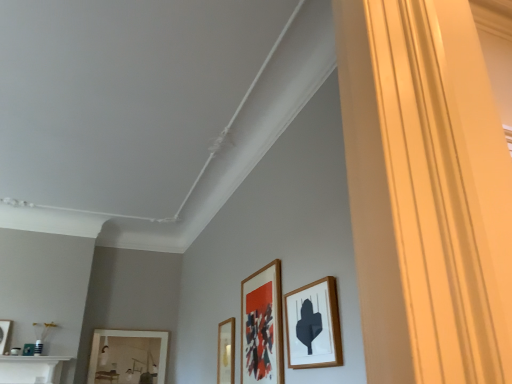
You are a GUI agent. You are given a task and a screenshot of the screen. Output one action in this format:
    pyautogui.click(x=<x>, y=<y>)
    Task: Click on the matte white picture frame at lower left, marked as the 2th picture frame in a back-to-front arrangement
    This screenshot has height=384, width=512.
    Given the screenshot: What is the action you would take?
    pyautogui.click(x=4, y=334)

What do you see at coordinates (226, 351) in the screenshot? This screenshot has height=384, width=512. I see `wooden picture frame at lower center, acting as the 3th picture frame starting from the front` at bounding box center [226, 351].

In order to face wooden picture frame at right, the 5th picture frame viewed from the left, should I rotate leftwards or rightwards?

Turn right by 7.136 degrees to look at wooden picture frame at right, the 5th picture frame viewed from the left.

Where is `matte wooden picture frame at center, marked as the second picture frame in a front-to-back arrangement`? This screenshot has width=512, height=384. matte wooden picture frame at center, marked as the second picture frame in a front-to-back arrangement is located at coordinates (262, 326).

From a real-world perspective, is wooden picture frame at lower left, which is the 5th picture frame from front to back, above or below matte white picture frame at lower left, the 5th picture frame from the right?

wooden picture frame at lower left, which is the 5th picture frame from front to back, is situated lower than matte white picture frame at lower left, the 5th picture frame from the right, in the real world.

Which is behind, point (151, 364) or point (8, 335)?

The point (151, 364) is farther from the camera.

From the image's perspective, is wooden picture frame at lower left, which is the 5th picture frame from front to back, located above or below matte white picture frame at lower left, which appears as the first picture frame when viewed from the left?

Clearly, from the image's perspective, wooden picture frame at lower left, which is the 5th picture frame from front to back, is below matte white picture frame at lower left, which appears as the first picture frame when viewed from the left.

Is wooden picture frame at lower left, which is the 5th picture frame from front to back, further to camera compared to matte white picture frame at lower left, which appears as the first picture frame when viewed from the left?

Yes, wooden picture frame at lower left, which is the 5th picture frame from front to back, is further from the viewer.

From a real-world perspective, is wooden picture frame at lower center, positioned as the 3th picture frame in back-to-front order, located beneath wooden picture frame at lower left, which is counted as the first picture frame, starting from the back?

Yes, from a real-world perspective, wooden picture frame at lower center, positioned as the 3th picture frame in back-to-front order, is under wooden picture frame at lower left, which is counted as the first picture frame, starting from the back.

Consider the image. Is wooden picture frame at lower left, the fourth picture frame positioned from the right, a part of wooden picture frame at lower center, positioned as the 3th picture frame in back-to-front order?

No, wooden picture frame at lower center, positioned as the 3th picture frame in back-to-front order, does not contain wooden picture frame at lower left, the fourth picture frame positioned from the right.

From the image's perspective, between wooden picture frame at lower center, which is the 3th picture frame from right to left, and wooden picture frame at lower left, which is the 5th picture frame from front to back, who is located below?

wooden picture frame at lower left, which is the 5th picture frame from front to back, appears lower in the image.

From the wooden picture frame at lower center, positioned as the 3th picture frame in back-to-front order, count 2nd picture frames backward and point to it. Please provide its 2D coordinates.

[(128, 357)]

Is wooden picture frame at lower left, the fourth picture frame positioned from the right, further to the viewer compared to matte wooden picture frame at center, acting as the second picture frame starting from the right?

Yes, it is.

From the matte wooden picture frame at center, marked as the second picture frame in a front-to-back arrangement, count 3rd picture frames backward and point to it. Please provide its 2D coordinates.

[(128, 357)]

Which is more to the right, wooden picture frame at lower left, the fourth picture frame positioned from the right, or matte wooden picture frame at center, marked as the second picture frame in a front-to-back arrangement?

matte wooden picture frame at center, marked as the second picture frame in a front-to-back arrangement, is more to the right.

Are wooden picture frame at lower left, the fourth picture frame positioned from the right, and wooden picture frame at lower center, positioned as the third picture frame in left-to-right order, far apart?

Absolutely, wooden picture frame at lower left, the fourth picture frame positioned from the right, is distant from wooden picture frame at lower center, positioned as the third picture frame in left-to-right order.

Between wooden picture frame at lower left, which is the 5th picture frame from front to back, and wooden picture frame at lower center, which is the 3th picture frame from right to left, which one appears on the left side from the viewer's perspective?

Positioned to the left is wooden picture frame at lower left, which is the 5th picture frame from front to back.

Where is `the 2nd picture frame above the wooden picture frame at lower center, positioned as the 3th picture frame in back-to-front order (from a real-world perspective)`? This screenshot has height=384, width=512. the 2nd picture frame above the wooden picture frame at lower center, positioned as the 3th picture frame in back-to-front order (from a real-world perspective) is located at coordinates (128, 357).

How many degrees apart are the facing directions of wooden picture frame at lower left, the fourth picture frame positioned from the right, and wooden picture frame at lower center, positioned as the 3th picture frame in back-to-front order?

The angular difference between wooden picture frame at lower left, the fourth picture frame positioned from the right, and wooden picture frame at lower center, positioned as the 3th picture frame in back-to-front order, is 90.9 degrees.

Which picture frame is the 3rd one when counting from the right side of the wooden picture frame at lower left, the fourth picture frame positioned from the right? Please provide its 2D coordinates.

[(313, 325)]

Is wooden picture frame at lower left, which is the 5th picture frame from front to back, not close to wooden picture frame at right, the first picture frame viewed from the right?

Yes.

Which object is positioned more to the left, wooden picture frame at lower left, which is counted as the first picture frame, starting from the back, or wooden picture frame at right, which ranks as the first picture frame in front-to-back order?

wooden picture frame at lower left, which is counted as the first picture frame, starting from the back, is more to the left.

Is wooden picture frame at lower left, which is the 5th picture frame from front to back, smaller than wooden picture frame at right, the first picture frame viewed from the right?

No.

From a real-world perspective, is matte white picture frame at lower left, marked as the 2th picture frame in a back-to-front arrangement, physically above wooden picture frame at right, the first picture frame viewed from the right?

Yes, from a real-world perspective, matte white picture frame at lower left, marked as the 2th picture frame in a back-to-front arrangement, is over wooden picture frame at right, the first picture frame viewed from the right

Would you say matte white picture frame at lower left, which appears as the first picture frame when viewed from the left, is inside or outside wooden picture frame at right, which ranks as the first picture frame in front-to-back order?

matte white picture frame at lower left, which appears as the first picture frame when viewed from the left, exists outside the volume of wooden picture frame at right, which ranks as the first picture frame in front-to-back order.

Are matte white picture frame at lower left, the fourth picture frame from the front, and wooden picture frame at right, which is the fifth picture frame in back-to-front order, making contact?

No, matte white picture frame at lower left, the fourth picture frame from the front, is not with wooden picture frame at right, which is the fifth picture frame in back-to-front order.

Is matte white picture frame at lower left, the 5th picture frame from the right, positioned behind wooden picture frame at right, the 5th picture frame viewed from the left?

Yes, the depth of matte white picture frame at lower left, the 5th picture frame from the right, is greater than that of wooden picture frame at right, the 5th picture frame viewed from the left.

Could you tell me if wooden picture frame at right, the first picture frame viewed from the right, is facing matte white picture frame at lower left, the 5th picture frame from the right?

No, wooden picture frame at right, the first picture frame viewed from the right, is not oriented towards matte white picture frame at lower left, the 5th picture frame from the right.

Considering the points (295, 359) and (7, 326), which point is behind, point (295, 359) or point (7, 326)?

The point (7, 326) is farther.

Considering the positions of objects wooden picture frame at right, which ranks as the first picture frame in front-to-back order, and matte white picture frame at lower left, which appears as the first picture frame when viewed from the left, in the image provided, who is in front, wooden picture frame at right, which ranks as the first picture frame in front-to-back order, or matte white picture frame at lower left, which appears as the first picture frame when viewed from the left,?

wooden picture frame at right, which ranks as the first picture frame in front-to-back order, is closer to the camera.

Can you tell me how much wooden picture frame at right, which is the fifth picture frame in back-to-front order, and matte white picture frame at lower left, which appears as the first picture frame when viewed from the left, differ in facing direction?

The angle between the facing direction of wooden picture frame at right, which is the fifth picture frame in back-to-front order, and the facing direction of matte white picture frame at lower left, which appears as the first picture frame when viewed from the left, is 92.5 degrees.

There is a wooden picture frame at lower left, which is the 5th picture frame from front to back. Where is `the 1st picture frame above it (from the image's perspective)`? This screenshot has height=384, width=512. the 1st picture frame above it (from the image's perspective) is located at coordinates (4, 334).

Which picture frame is the 2nd one when counting from the front of the wooden picture frame at lower left, the fourth picture frame positioned from the right? Please provide its 2D coordinates.

[(226, 351)]

Which object lies further to the anchor point wooden picture frame at lower center, positioned as the 3th picture frame in back-to-front order, matte wooden picture frame at center, which is the fourth picture frame in back-to-front order, or wooden picture frame at lower left, which is the 5th picture frame from front to back?

The object further to wooden picture frame at lower center, positioned as the 3th picture frame in back-to-front order, is wooden picture frame at lower left, which is the 5th picture frame from front to back.

From the image, which object appears to be nearer to wooden picture frame at lower left, which is the 5th picture frame from front to back, wooden picture frame at lower center, positioned as the 3th picture frame in back-to-front order, or matte white picture frame at lower left, the 5th picture frame from the right?

Based on the image, matte white picture frame at lower left, the 5th picture frame from the right, appears to be nearer to wooden picture frame at lower left, which is the 5th picture frame from front to back.

Estimate the real-world distances between objects in this image. Which object is further from matte wooden picture frame at center, the 4th picture frame positioned from the left, wooden picture frame at right, the first picture frame viewed from the right, or wooden picture frame at lower center, positioned as the third picture frame in left-to-right order?

wooden picture frame at lower center, positioned as the third picture frame in left-to-right order, is positioned further to the anchor matte wooden picture frame at center, the 4th picture frame positioned from the left.

When comparing their distances from wooden picture frame at right, the first picture frame viewed from the right, does matte wooden picture frame at center, acting as the second picture frame starting from the right, or matte white picture frame at lower left, which appears as the first picture frame when viewed from the left, seem closer?

The object closer to wooden picture frame at right, the first picture frame viewed from the right, is matte wooden picture frame at center, acting as the second picture frame starting from the right.

Considering their positions, is matte wooden picture frame at center, the 4th picture frame positioned from the left, positioned further to matte white picture frame at lower left, which appears as the first picture frame when viewed from the left, than wooden picture frame at lower center, acting as the 3th picture frame starting from the front?

matte wooden picture frame at center, the 4th picture frame positioned from the left, is positioned further to the anchor matte white picture frame at lower left, which appears as the first picture frame when viewed from the left.

From the image, which object appears to be nearer to matte white picture frame at lower left, the 5th picture frame from the right, wooden picture frame at lower center, which is the 3th picture frame from right to left, or wooden picture frame at lower left, the fourth picture frame positioned from the right?

The object closer to matte white picture frame at lower left, the 5th picture frame from the right, is wooden picture frame at lower left, the fourth picture frame positioned from the right.

In the scene shown: Based on their spatial positions, is matte wooden picture frame at center, which is the fourth picture frame in back-to-front order, or wooden picture frame at right, the 5th picture frame viewed from the left, further from wooden picture frame at lower center, positioned as the third picture frame in left-to-right order?

Based on the image, wooden picture frame at right, the 5th picture frame viewed from the left, appears to be further to wooden picture frame at lower center, positioned as the third picture frame in left-to-right order.

Which object lies further to the anchor point wooden picture frame at lower center, acting as the 3th picture frame starting from the front, wooden picture frame at lower left, placed as the second picture frame when sorted from left to right, or matte white picture frame at lower left, the 5th picture frame from the right?

Among the two, matte white picture frame at lower left, the 5th picture frame from the right, is located further to wooden picture frame at lower center, acting as the 3th picture frame starting from the front.

At what (x,y) coordinates should I click in order to perform the action: click on picture frame between wooden picture frame at right, the first picture frame viewed from the right, and wooden picture frame at lower center, which is the 3th picture frame from right to left, in the front-back direction. Please return your answer as a coordinate pair (x, y). The width and height of the screenshot is (512, 384). Looking at the image, I should click on (262, 326).

Where is `picture frame located between matte white picture frame at lower left, the fourth picture frame from the front, and wooden picture frame at lower center, positioned as the 3th picture frame in back-to-front order, in the left-right direction`? picture frame located between matte white picture frame at lower left, the fourth picture frame from the front, and wooden picture frame at lower center, positioned as the 3th picture frame in back-to-front order, in the left-right direction is located at coordinates (128, 357).